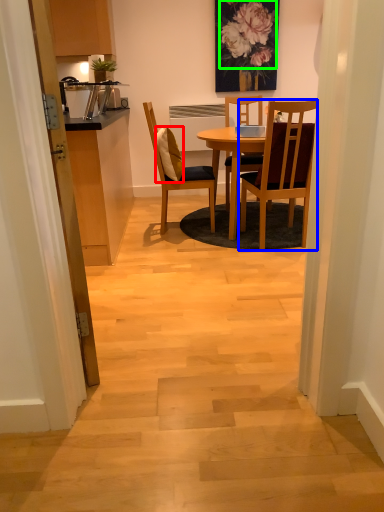
Question: Which is farther away from pillow (highlighted by a red box)? chair (highlighted by a blue box) or flower (highlighted by a green box)?

Choices:
 (A) chair
 (B) flower

Answer: (B)